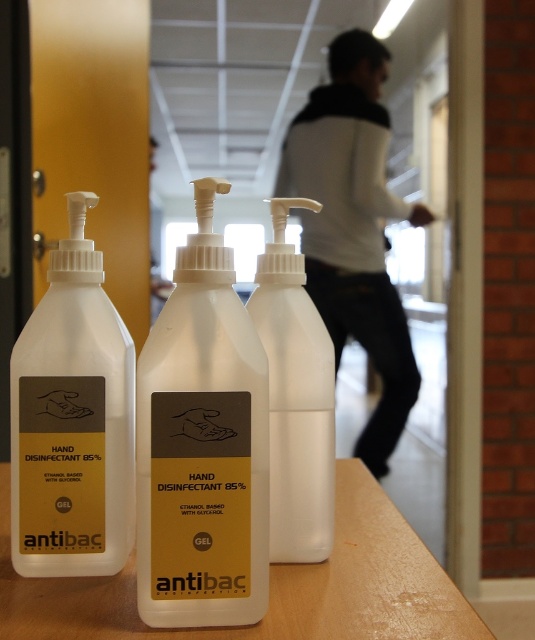
You are organizing a first aid kit and need to place the white gel hand disinfectant at center and the white matte hand sanitizer at left into a compartment that is 12 centimeters wide. Will both items fit side by side in the compartment?

The distance between the white gel hand disinfectant at center and white matte hand sanitizer at left is 13.24 centimeters, which is wider than the 12 centimeter compartment. Therefore, they cannot fit side by side in the compartment.

You are organizing a first aid kit and need to fit both the white gel hand disinfectant at center and the white matte hand sanitizer at left into a narrow compartment. Based on their sizes, which one will fit better?

The white gel hand disinfectant at center is thinner than the white matte hand sanitizer at left, so it will fit better in the narrow compartment.

You are a delivery person who needs to place a new hand disinfectant bottle on the wooden surface. The new bottle is 22 inches tall. Can you place it in the same position as the white gel hand disinfectant at center without it touching the camera?

The white gel hand disinfectant at center is 21.77 inches away from the camera. Since the new bottle is 22 inches tall, placing it in the same position would mean its height exceeds the distance from the camera, potentially causing it to touch the camera. Therefore, it might not be safe to place the new bottle there.